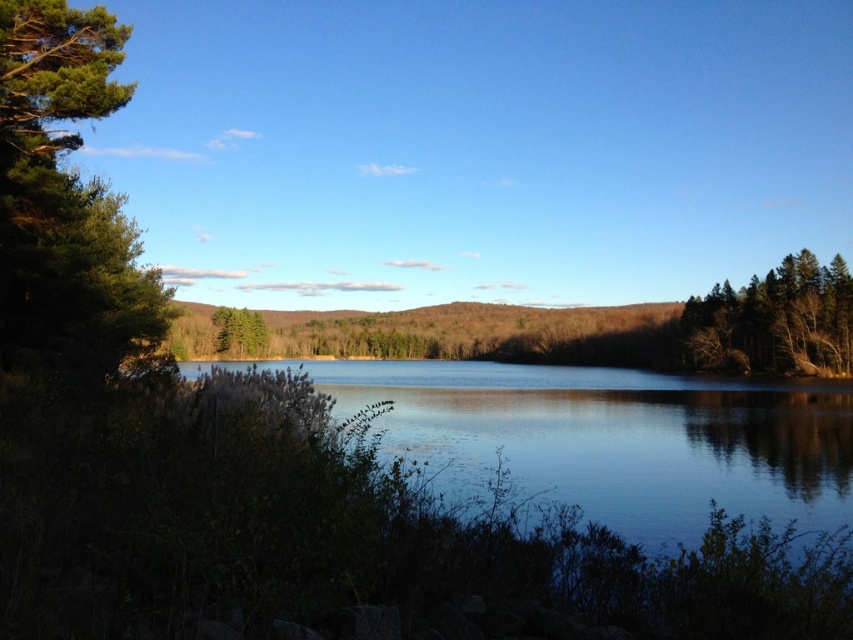
Question: Which point is closer to the camera?

Choices:
 (A) (399, 406)
 (B) (694, 355)
 (C) (247, 323)

Answer: (A)

Question: Which object is farther from the camera taking this photo?

Choices:
 (A) green matte tree at center-left
 (B) clear water at center

Answer: (A)

Question: Which object appears farthest from the camera in this image?

Choices:
 (A) clear water at center
 (B) green matte tree at right

Answer: (B)

Question: Does green matte tree at right have a lesser width compared to green matte tree at center-left?

Choices:
 (A) no
 (B) yes

Answer: (A)

Question: Does clear water at center have a greater width compared to green matte tree at center-left?

Choices:
 (A) yes
 (B) no

Answer: (A)

Question: Observing the image, what is the correct spatial positioning of clear water at center in reference to green matte tree at center-left?

Choices:
 (A) left
 (B) right

Answer: (B)